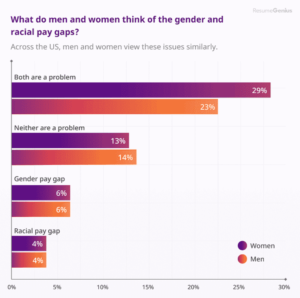
You are a GUI agent. You are given a task and a screenshot of the screen. Output one action in this format:
    pyautogui.click(x=<x>, y=<y>)
    Task: Click on the purple bar
    The image size is (300, 298).
    Given the screenshot: What is the action you would take?
    pyautogui.click(x=16, y=243)